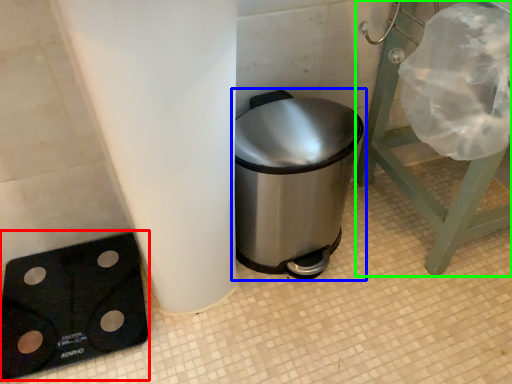
Question: Which object is the farthest from weight scale (highlighted by a red box)? Choose among these: waste container (highlighted by a blue box) or furniture (highlighted by a green box).

Choices:
 (A) waste container
 (B) furniture

Answer: (B)